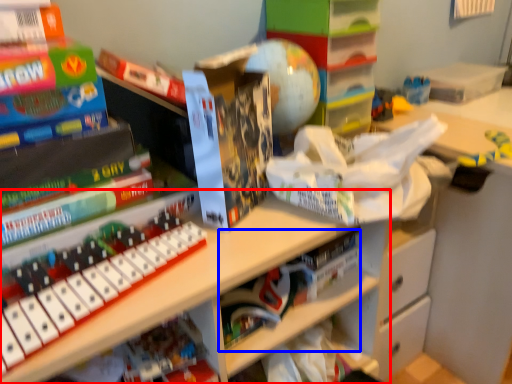
Question: Among these objects, which one is farthest to the camera, shelf (highlighted by a red box) or book (highlighted by a blue box)?

Choices:
 (A) shelf
 (B) book

Answer: (B)